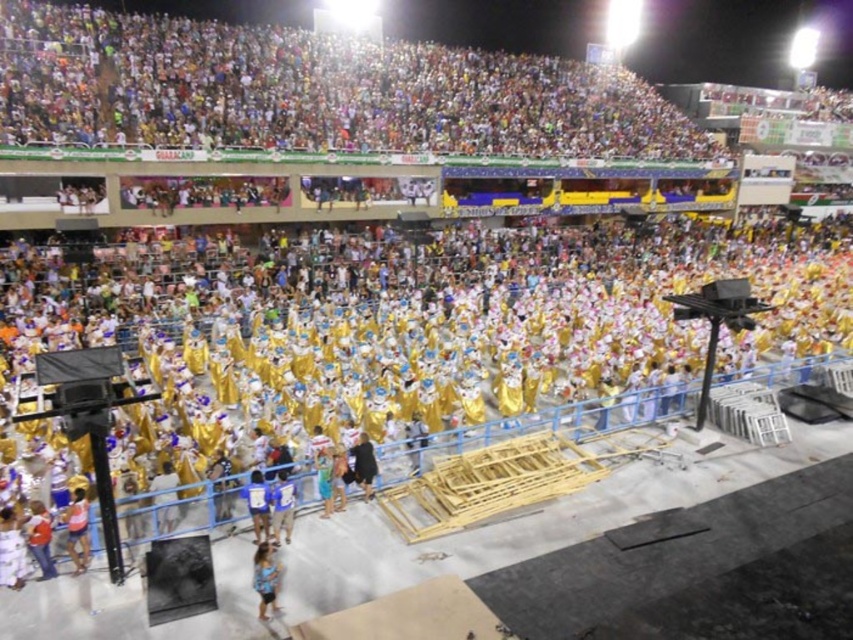
Can you confirm if blue fabric at lower center is positioned to the left of light blue fabric dress at center?

Indeed, blue fabric at lower center is positioned on the left side of light blue fabric dress at center.

Who is more distant from viewer, [253,481] or [326,515]?

The point [326,515] is more distant.

This screenshot has width=853, height=640. In order to click on blue fabric at lower center in this screenshot , I will do `click(257, 504)`.

Measure the distance between blue fabric dress at lower center and blue fabric at lower center.

blue fabric dress at lower center is 2.02 meters from blue fabric at lower center.

Locate an element on the screen. blue fabric dress at lower center is located at coordinates (265, 579).

Does point (263, 609) come closer to viewer compared to point (263, 518)?

Yes, it is.

Where is `blue fabric dress at lower center`? blue fabric dress at lower center is located at coordinates (265, 579).

Can you confirm if orange shirt at lower left is thinner than black fabric person at center?

Correct, orange shirt at lower left's width is less than black fabric person at center's.

Who is taller, orange shirt at lower left or black fabric person at center?

black fabric person at center

Is point (41, 579) positioned in front of point (363, 477)?

Yes.

The image size is (853, 640). Identify the location of orange shirt at lower left. (39, 538).